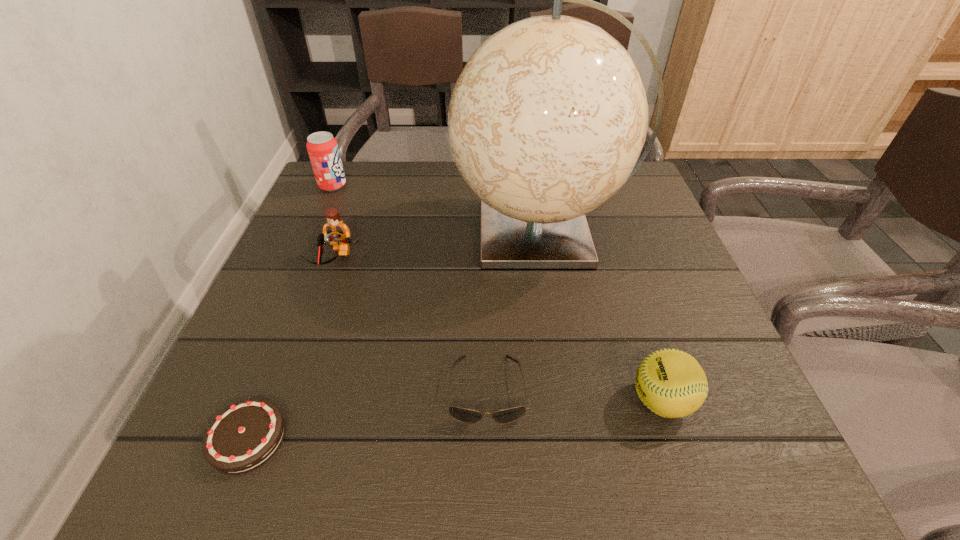
I want to click on free space that satisfies the following two spatial constraints: 1. on the surface of the globe showing Europe and Africa; 2. on the front-facing side of the sunglasses, so click(565, 389).

You are a GUI agent. You are given a task and a screenshot of the screen. Output one action in this format:
    pyautogui.click(x=<x>, y=<y>)
    Task: Click on the free space that satisfies the following two spatial constraints: 1. on the logo side of the softball; 2. on the front side of the shortest object
    This screenshot has height=540, width=960.
    Given the screenshot: What is the action you would take?
    pyautogui.click(x=674, y=438)